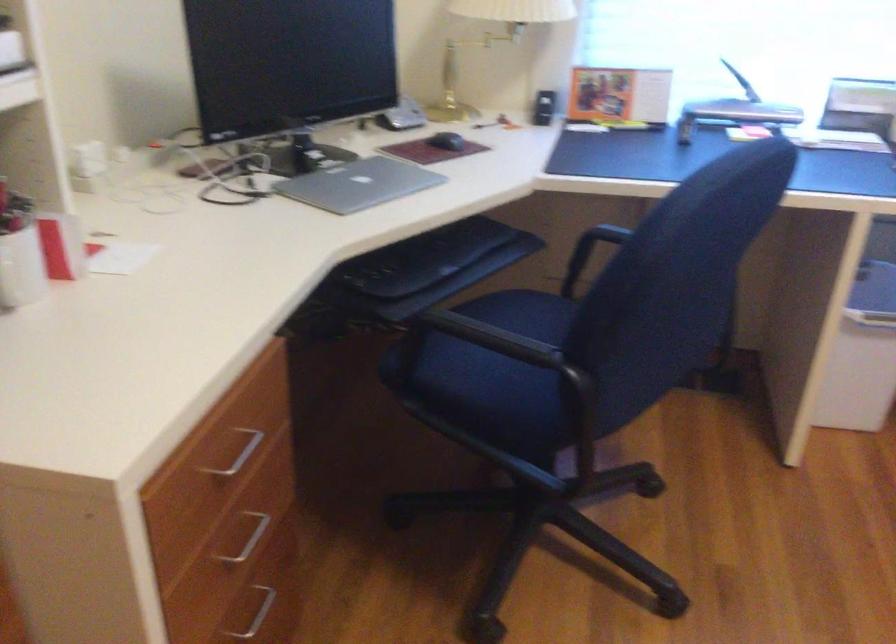
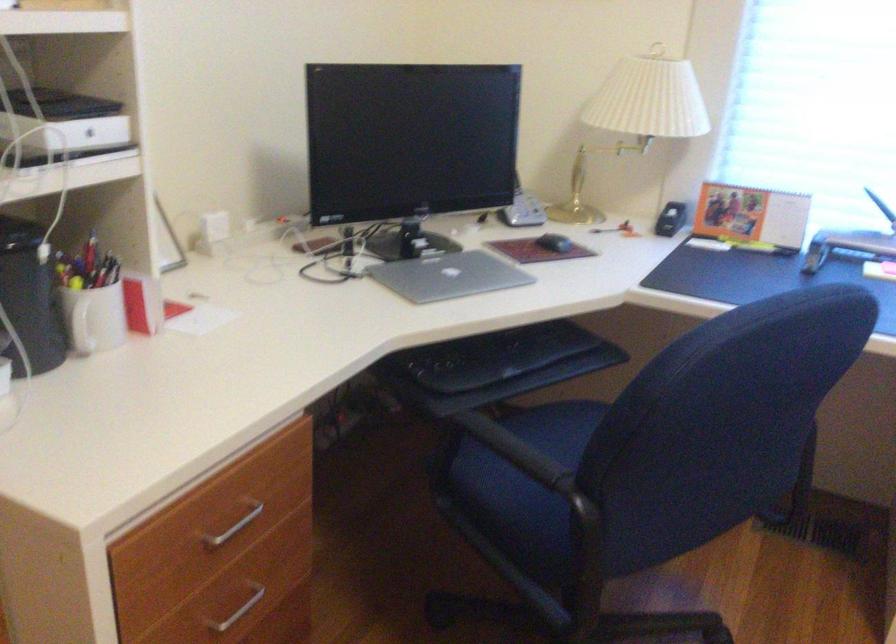
In the second image, find the point that corresponds to point 512,355 in the first image.

(524, 462)